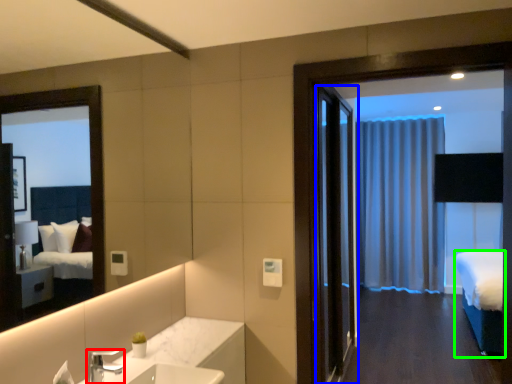
Question: Based on their relative distances, which object is farther from tap (highlighted by a red box)? Choose from door (highlighted by a blue box) and bed (highlighted by a green box).

Choices:
 (A) door
 (B) bed

Answer: (A)